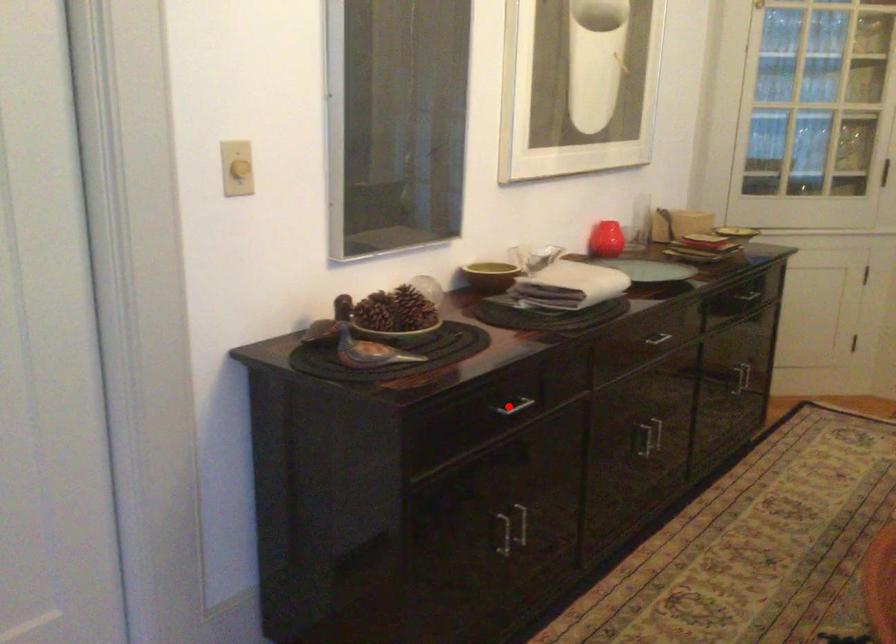
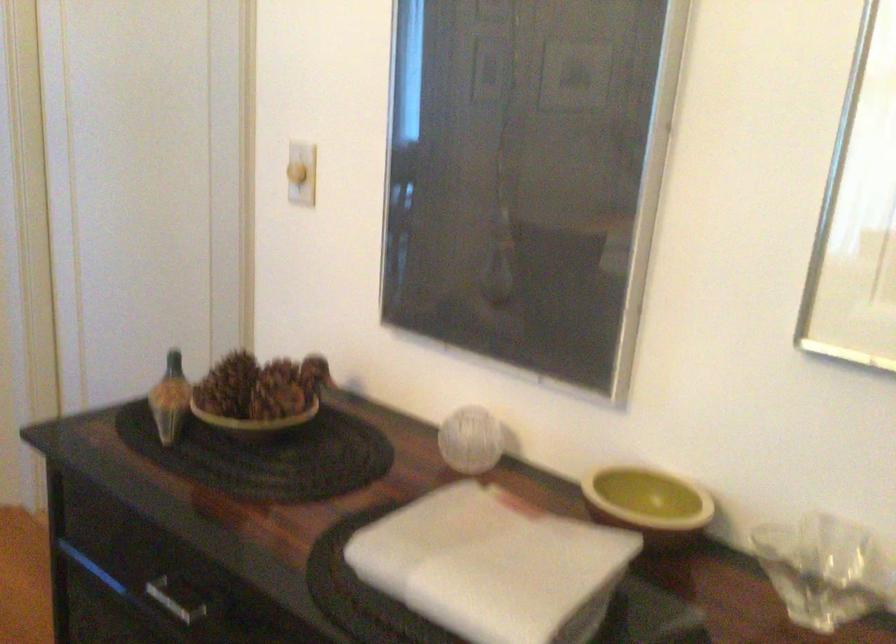
In the second image, find the point that corresponds to the highlighted location in the first image.

(177, 598)